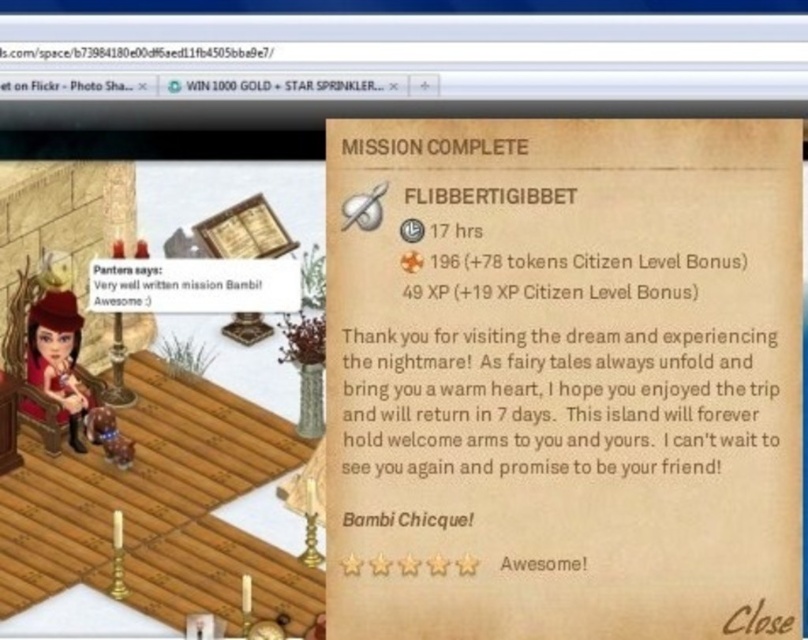
You are a game developer analyzing this mission completion screen. You notice two elements on the screen related to the mission completion message. The white paper at upper center and the brown paper text at upper center. Which of these two elements is bigger in size?

The white paper at upper center is larger in size than the brown paper text at upper center.

You are a game developer reviewing the mission completion screen. You notice the white paper at upper center and the brown paper text at upper center. Which one is positioned higher in the image?

The white paper at upper center is positioned higher than the brown paper text at upper center.